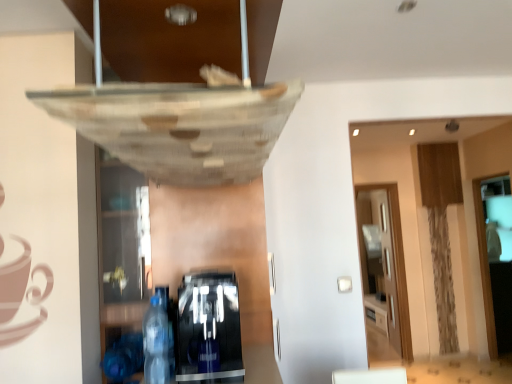
This screenshot has height=384, width=512. What do you see at coordinates (122, 244) in the screenshot? I see `transparent glass shelf at lower left, which is the 1th shelf in left-to-right order` at bounding box center [122, 244].

What is the approximate height of transparent plastic bottle at lower left?

11.89 inches.

Find the location of a particular element. This screenshot has width=512, height=384. black glossy coffee machine at lower center, the second shelf in the left-to-right sequence is located at coordinates (178, 244).

In order to face black glossy coffee machine at lower center, the first shelf when ordered from right to left, should I rotate leftwards or rightwards?

A 4.928 degree turn to the left will do.

What do you see at coordinates (386, 259) in the screenshot? I see `transparent wood glass door at right, placed as the 2th glass door when sorted from front to back` at bounding box center [386, 259].

Locate an element on the screen. The image size is (512, 384). transparent glass door at right, which is the first glass door from front to back is located at coordinates (485, 267).

The image size is (512, 384). What do you see at coordinates (485, 267) in the screenshot? I see `transparent glass door at right, which ranks as the second glass door in left-to-right order` at bounding box center [485, 267].

The image size is (512, 384). Identify the location of transparent glass shelf at lower left, which is the second shelf in right-to-left order. (122, 244).

From the image's perspective, does transparent glass shelf at lower left, which is the 1th shelf in left-to-right order, appear lower than transparent plastic bottle at lower left?

No, from the image's perspective, transparent glass shelf at lower left, which is the 1th shelf in left-to-right order, is not below transparent plastic bottle at lower left.

Based on the photo, based on their sizes in the image, would you say transparent glass shelf at lower left, which is the second shelf in right-to-left order, is bigger or smaller than transparent plastic bottle at lower left?

transparent glass shelf at lower left, which is the second shelf in right-to-left order, is bigger than transparent plastic bottle at lower left.

Considering the relative sizes of transparent glass shelf at lower left, which is the 1th shelf in left-to-right order, and transparent plastic bottle at lower left in the image provided, is transparent glass shelf at lower left, which is the 1th shelf in left-to-right order, shorter than transparent plastic bottle at lower left?

No, transparent glass shelf at lower left, which is the 1th shelf in left-to-right order, is not shorter than transparent plastic bottle at lower left.

Is transparent glass shelf at lower left, which is the second shelf in right-to-left order, at the left side of transparent plastic bottle at lower left?

Correct, you'll find transparent glass shelf at lower left, which is the second shelf in right-to-left order, to the left of transparent plastic bottle at lower left.

Is transparent glass door at right, acting as the 2th glass door starting from the back, bigger or smaller than transparent plastic bottle at lower left?

transparent glass door at right, acting as the 2th glass door starting from the back, is bigger than transparent plastic bottle at lower left.

Locate an element on the screen. This screenshot has height=384, width=512. bottle located above the transparent glass door at right, the first glass door when ordered from right to left (from the image's perspective) is located at coordinates (156, 343).

Is transparent glass door at right, which is the first glass door from front to back, oriented away from transparent plastic bottle at lower left?

No, transparent glass door at right, which is the first glass door from front to back, is not facing the opposite direction of transparent plastic bottle at lower left.

Based on the photo, would you say transparent glass door at right, which is the first glass door from front to back, is to the left or to the right of transparent plastic bottle at lower left in the picture?

Based on their positions, transparent glass door at right, which is the first glass door from front to back, is located to the right of transparent plastic bottle at lower left.

Could you tell me if transparent wood glass door at right, the first glass door viewed from the back, is turned towards transparent glass door at right, acting as the 2th glass door starting from the back?

No, transparent wood glass door at right, the first glass door viewed from the back, is not aimed at transparent glass door at right, acting as the 2th glass door starting from the back.

How far apart are transparent wood glass door at right, placed as the second glass door when sorted from right to left, and transparent glass door at right, acting as the 2th glass door starting from the back?

transparent wood glass door at right, placed as the second glass door when sorted from right to left, and transparent glass door at right, acting as the 2th glass door starting from the back, are 3.77 feet apart from each other.

Where is `glass door that is above the transparent glass door at right, the first glass door when ordered from right to left (from a real-world perspective)`? The width and height of the screenshot is (512, 384). glass door that is above the transparent glass door at right, the first glass door when ordered from right to left (from a real-world perspective) is located at coordinates (386, 259).

Is transparent wood glass door at right, placed as the second glass door when sorted from right to left, not inside transparent glass door at right, acting as the 2th glass door starting from the back?

Yes, transparent wood glass door at right, placed as the second glass door when sorted from right to left, is outside of transparent glass door at right, acting as the 2th glass door starting from the back.

From their relative heights in the image, would you say black glossy coffee machine at lower center, the second shelf in the left-to-right sequence, is taller or shorter than transparent glass door at right, which ranks as the second glass door in left-to-right order?

black glossy coffee machine at lower center, the second shelf in the left-to-right sequence, is shorter than transparent glass door at right, which ranks as the second glass door in left-to-right order.

Considering their positions, is black glossy coffee machine at lower center, the first shelf when ordered from right to left, located in front of or behind transparent glass door at right, which is the first glass door from front to back?

In the image, black glossy coffee machine at lower center, the first shelf when ordered from right to left, appears in front of transparent glass door at right, which is the first glass door from front to back.

From the transparent glass door at right, which is the first glass door from front to back, count 1st shelfs forward and point to it. Please provide its 2D coordinates.

[(178, 244)]

Is point (257, 231) behind point (494, 339)?

No, (257, 231) is closer to viewer.

Based on their positions, is transparent glass shelf at lower left, which is the 1th shelf in left-to-right order, located to the left or right of black glossy coffee machine at lower center, the first shelf when ordered from right to left?

transparent glass shelf at lower left, which is the 1th shelf in left-to-right order, is positioned on black glossy coffee machine at lower center, the first shelf when ordered from right to left,'s left side.

Is transparent glass shelf at lower left, which is the 1th shelf in left-to-right order, positioned far away from black glossy coffee machine at lower center, the first shelf when ordered from right to left?

That's not correct — transparent glass shelf at lower left, which is the 1th shelf in left-to-right order, is a little close to black glossy coffee machine at lower center, the first shelf when ordered from right to left.

Considering the relative positions of transparent glass shelf at lower left, which is the second shelf in right-to-left order, and black glossy coffee machine at lower center, the second shelf in the left-to-right sequence, in the image provided, is transparent glass shelf at lower left, which is the second shelf in right-to-left order, behind black glossy coffee machine at lower center, the second shelf in the left-to-right sequence,?

No, transparent glass shelf at lower left, which is the second shelf in right-to-left order, is closer to the camera.

Considering the sizes of objects transparent glass shelf at lower left, which is the second shelf in right-to-left order, and black glossy coffee machine at lower center, the second shelf in the left-to-right sequence, in the image provided, who is bigger, transparent glass shelf at lower left, which is the second shelf in right-to-left order, or black glossy coffee machine at lower center, the second shelf in the left-to-right sequence,?

black glossy coffee machine at lower center, the second shelf in the left-to-right sequence.

Between transparent wood glass door at right, placed as the second glass door when sorted from right to left, and transparent glass shelf at lower left, which is the 1th shelf in left-to-right order, which one is positioned in front?

transparent glass shelf at lower left, which is the 1th shelf in left-to-right order, is more forward.

Could transparent glass shelf at lower left, which is the 1th shelf in left-to-right order, be considered to be inside transparent wood glass door at right, placed as the second glass door when sorted from right to left?

Definitely not — transparent glass shelf at lower left, which is the 1th shelf in left-to-right order, is not inside transparent wood glass door at right, placed as the second glass door when sorted from right to left.

How different are the orientations of transparent wood glass door at right, which is counted as the 1th glass door, starting from the left, and transparent glass shelf at lower left, which is the second shelf in right-to-left order, in degrees?

The angle between the facing direction of transparent wood glass door at right, which is counted as the 1th glass door, starting from the left, and the facing direction of transparent glass shelf at lower left, which is the second shelf in right-to-left order, is 1.62 degrees.

Is black glossy coffee machine at lower center, the second shelf in the left-to-right sequence, not near transparent wood glass door at right, which is counted as the 1th glass door, starting from the left?

black glossy coffee machine at lower center, the second shelf in the left-to-right sequence, is positioned a significant distance from transparent wood glass door at right, which is counted as the 1th glass door, starting from the left.

Based on the photo, from the image's perspective, is black glossy coffee machine at lower center, the first shelf when ordered from right to left, over transparent wood glass door at right, which is counted as the 1th glass door, starting from the left?

Yes.

Does point (263, 294) come farther from viewer compared to point (392, 286)?

No, (263, 294) is closer to viewer.

Does black glossy coffee machine at lower center, the first shelf when ordered from right to left, have a greater width compared to transparent wood glass door at right, the first glass door viewed from the back?

Yes.

The height and width of the screenshot is (384, 512). Find the location of `shelf on the left side of transparent plastic bottle at lower left`. shelf on the left side of transparent plastic bottle at lower left is located at coordinates (122, 244).

There is a transparent plastic bottle at lower left. Where is `the 2nd glass door below it (from a real-world perspective)`? The width and height of the screenshot is (512, 384). the 2nd glass door below it (from a real-world perspective) is located at coordinates (485, 267).

Considering their positions, is transparent glass door at right, acting as the 2th glass door starting from the back, positioned further to black glossy coffee machine at lower center, the first shelf when ordered from right to left, than transparent glass shelf at lower left, which is the 1th shelf in left-to-right order?

Based on the image, transparent glass door at right, acting as the 2th glass door starting from the back, appears to be further to black glossy coffee machine at lower center, the first shelf when ordered from right to left.

In the scene shown: Considering their positions, is transparent glass door at right, which is the first glass door from front to back, positioned closer to transparent glass shelf at lower left, which is the 1th shelf in left-to-right order, than transparent plastic bottle at lower left?

transparent plastic bottle at lower left lies closer to transparent glass shelf at lower left, which is the 1th shelf in left-to-right order, than the other object.

From the image, which object appears to be farther from transparent plastic bottle at lower left, transparent wood glass door at right, the first glass door viewed from the back, or transparent glass door at right, acting as the 2th glass door starting from the back?

The object further to transparent plastic bottle at lower left is transparent wood glass door at right, the first glass door viewed from the back.

Considering their positions, is transparent plastic bottle at lower left positioned further to transparent wood glass door at right, which is counted as the 1th glass door, starting from the left, than black glossy coffee machine at lower center, the first shelf when ordered from right to left?

The object further to transparent wood glass door at right, which is counted as the 1th glass door, starting from the left, is transparent plastic bottle at lower left.

From the image, which object appears to be nearer to transparent glass shelf at lower left, which is the second shelf in right-to-left order, transparent plastic bottle at lower left or transparent wood glass door at right, which is counted as the 1th glass door, starting from the left?

The object closer to transparent glass shelf at lower left, which is the second shelf in right-to-left order, is transparent plastic bottle at lower left.

Considering their positions, is black glossy coffee machine at lower center, the second shelf in the left-to-right sequence, positioned closer to transparent glass door at right, acting as the 2th glass door starting from the back, than transparent plastic bottle at lower left?

The object closer to transparent glass door at right, acting as the 2th glass door starting from the back, is black glossy coffee machine at lower center, the second shelf in the left-to-right sequence.

Which object lies nearer to the anchor point transparent plastic bottle at lower left, transparent glass shelf at lower left, which is the second shelf in right-to-left order, or transparent wood glass door at right, which is counted as the 1th glass door, starting from the left?

transparent glass shelf at lower left, which is the second shelf in right-to-left order, lies closer to transparent plastic bottle at lower left than the other object.

Looking at the image, which one is located further to transparent wood glass door at right, which is counted as the 1th glass door, starting from the left, transparent plastic bottle at lower left or transparent glass door at right, the first glass door when ordered from right to left?

transparent plastic bottle at lower left lies further to transparent wood glass door at right, which is counted as the 1th glass door, starting from the left, than the other object.

Find the location of `shelf between transparent plastic bottle at lower left and black glossy coffee machine at lower center, the first shelf when ordered from right to left, in the front-back direction`. shelf between transparent plastic bottle at lower left and black glossy coffee machine at lower center, the first shelf when ordered from right to left, in the front-back direction is located at coordinates (122, 244).

This screenshot has height=384, width=512. I want to click on bottle between transparent glass shelf at lower left, which is the 1th shelf in left-to-right order, and transparent glass door at right, which ranks as the second glass door in left-to-right order, in the horizontal direction, so click(x=156, y=343).

Locate an element on the screen. Image resolution: width=512 pixels, height=384 pixels. shelf between transparent glass shelf at lower left, which is the second shelf in right-to-left order, and transparent wood glass door at right, the first glass door viewed from the back, from front to back is located at coordinates (178, 244).

Image resolution: width=512 pixels, height=384 pixels. Find the location of `glass door located between transparent glass shelf at lower left, which is the 1th shelf in left-to-right order, and transparent glass door at right, which ranks as the second glass door in left-to-right order, in the left-right direction`. glass door located between transparent glass shelf at lower left, which is the 1th shelf in left-to-right order, and transparent glass door at right, which ranks as the second glass door in left-to-right order, in the left-right direction is located at coordinates (386, 259).